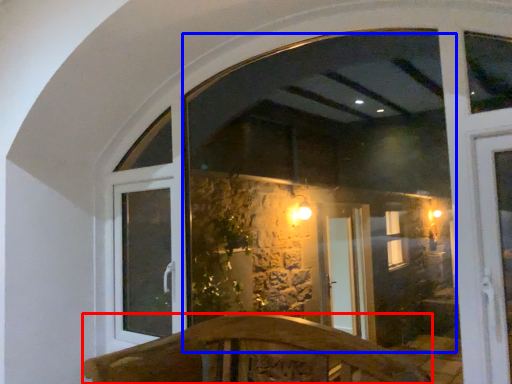
Question: Which point is further to the camera, furniture (highlighted by a red box) or window screen (highlighted by a blue box)?

Choices:
 (A) furniture
 (B) window screen

Answer: (B)